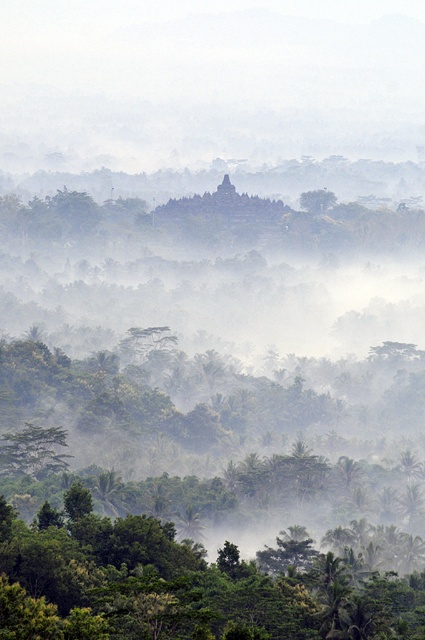
Question: In this image, where is green leafy tree at lower center located relative to green leafy tree at lower left?

Choices:
 (A) left
 (B) right

Answer: (B)

Question: Which point is farther to the camera?

Choices:
 (A) (14, 445)
 (B) (39, 602)

Answer: (A)

Question: Which point appears farthest from the camera in this image?

Choices:
 (A) (27, 435)
 (B) (328, 561)

Answer: (A)

Question: Does green leafy tree at lower center appear on the right side of green leafy tree at lower left?

Choices:
 (A) yes
 (B) no

Answer: (A)

Question: Can you confirm if green leafy tree at lower center is positioned above green leafy tree at lower left?

Choices:
 (A) no
 (B) yes

Answer: (A)